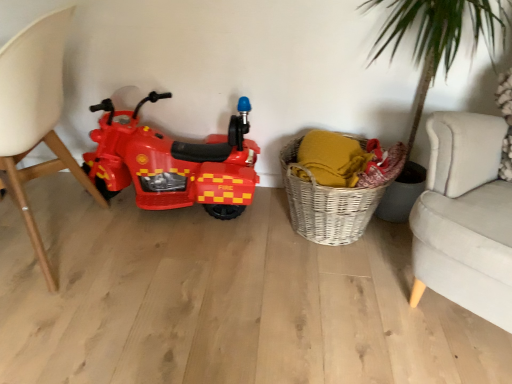
Describe the element at coordinates (173, 163) in the screenshot. The image size is (512, 384). I see `shiny plastic toy motorcycle at left` at that location.

The height and width of the screenshot is (384, 512). Describe the element at coordinates (325, 204) in the screenshot. I see `woven wicker basket at lower right` at that location.

The image size is (512, 384). In order to click on shiny plastic toy motorcycle at left in this screenshot , I will do `click(173, 163)`.

How far apart are woven wicker basket at lower right and matte white chair at left?

woven wicker basket at lower right is 89.79 centimeters from matte white chair at left.

Is woven wicker basket at lower right oriented towards matte white chair at left?

No, woven wicker basket at lower right is not facing towards matte white chair at left.

Is woven wicker basket at lower right closer to the viewer compared to matte white chair at left?

No, woven wicker basket at lower right is further to the viewer.

You are a GUI agent. You are given a task and a screenshot of the screen. Output one action in this format:
    pyautogui.click(x=<x>, y=<y>)
    Task: Click on the land vehicle behind the woven wicker basket at lower right
    This screenshot has height=384, width=512.
    Given the screenshot: What is the action you would take?
    pyautogui.click(x=173, y=163)

Is woven wicker basket at lower right shorter than shiny plastic toy motorcycle at left?

Yes, woven wicker basket at lower right is shorter than shiny plastic toy motorcycle at left.

Is woven wicker basket at lower right oriented away from shiny plastic toy motorcycle at left?

woven wicker basket at lower right does not have its back to shiny plastic toy motorcycle at left.

From a real-world perspective, is matte white chair at left positioned under shiny plastic toy motorcycle at left based on gravity?

Actually, matte white chair at left is physically above shiny plastic toy motorcycle at left in the real world.

Who is shorter, matte white chair at left or shiny plastic toy motorcycle at left?

With less height is shiny plastic toy motorcycle at left.

Is matte white chair at left thinner than shiny plastic toy motorcycle at left?

No.

Is matte white chair at left turned away from shiny plastic toy motorcycle at left?

No.

Does shiny plastic toy motorcycle at left lie behind woven wicker basket at lower right?

Yes, shiny plastic toy motorcycle at left is further from the camera.

Which is closer to the camera, (193, 153) or (292, 209)?

Point (193, 153)

Which object is positioned more to the right, shiny plastic toy motorcycle at left or woven wicker basket at lower right?

Positioned to the right is woven wicker basket at lower right.

Which of these two, shiny plastic toy motorcycle at left or matte white chair at left, is wider?

matte white chair at left.

Can you tell me how much shiny plastic toy motorcycle at left and matte white chair at left differ in facing direction?

There is a 90-degree angle between the facing directions of shiny plastic toy motorcycle at left and matte white chair at left.

Is shiny plastic toy motorcycle at left not close to matte white chair at left?

No, there isn't a large distance between shiny plastic toy motorcycle at left and matte white chair at left.

Does shiny plastic toy motorcycle at left turn towards matte white chair at left?

Yes, shiny plastic toy motorcycle at left is aimed at matte white chair at left.

Can you confirm if matte white chair at left is positioned to the right of woven wicker basket at lower right?

No.

Based on the photo, based on their sizes in the image, would you say matte white chair at left is bigger or smaller than woven wicker basket at lower right?

In the image, matte white chair at left appears to be larger than woven wicker basket at lower right.

Is matte white chair at left with woven wicker basket at lower right?

No, matte white chair at left is not touching woven wicker basket at lower right.

From the image's perspective, which is above, matte white chair at left or woven wicker basket at lower right?

matte white chair at left appears higher in the image.

I want to click on chair in front of the woven wicker basket at lower right, so click(35, 116).

This screenshot has width=512, height=384. In order to click on land vehicle on the left of woven wicker basket at lower right in this screenshot , I will do coord(173,163).

Based on their spatial positions, is shiny plastic toy motorcycle at left or woven wicker basket at lower right closer to matte white chair at left?

Among the two, shiny plastic toy motorcycle at left is located nearer to matte white chair at left.

When comparing their distances from matte white chair at left, does woven wicker basket at lower right or shiny plastic toy motorcycle at left seem further?

woven wicker basket at lower right is positioned further to the anchor matte white chair at left.

Looking at the image, which one is located closer to shiny plastic toy motorcycle at left, woven wicker basket at lower right or matte white chair at left?

matte white chair at left is closer to shiny plastic toy motorcycle at left.

When comparing their distances from woven wicker basket at lower right, does shiny plastic toy motorcycle at left or matte white chair at left seem further?

matte white chair at left is further to woven wicker basket at lower right.

Considering their positions, is matte white chair at left positioned further to woven wicker basket at lower right than shiny plastic toy motorcycle at left?

matte white chair at left lies further to woven wicker basket at lower right than the other object.

When comparing their distances from shiny plastic toy motorcycle at left, does matte white chair at left or woven wicker basket at lower right seem closer?

The object closer to shiny plastic toy motorcycle at left is matte white chair at left.

The height and width of the screenshot is (384, 512). I want to click on land vehicle located between matte white chair at left and woven wicker basket at lower right in the left-right direction, so click(173, 163).